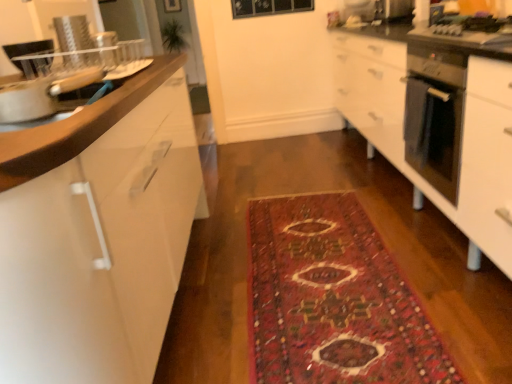
Question: Is white glossy cabinet at left taller or shorter than satin silver oven at right?

Choices:
 (A) tall
 (B) short

Answer: (A)

Question: In terms of width, does white glossy cabinet at left look wider or thinner when compared to satin silver oven at right?

Choices:
 (A) wide
 (B) thin

Answer: (A)

Question: Which is nearer to the carpeted rug at center?

Choices:
 (A) satin silver oven at right
 (B) white glossy cabinet at left
 (C) metallic stainless steel microwave at upper right
 (D) metallic stainless steel gas stove at right

Answer: (B)

Question: Considering the real-world distances, which object is closest to the metallic stainless steel gas stove at right?

Choices:
 (A) metallic stainless steel microwave at upper right
 (B) carpeted rug at center
 (C) white glossy cabinet at left
 (D) satin silver oven at right

Answer: (D)